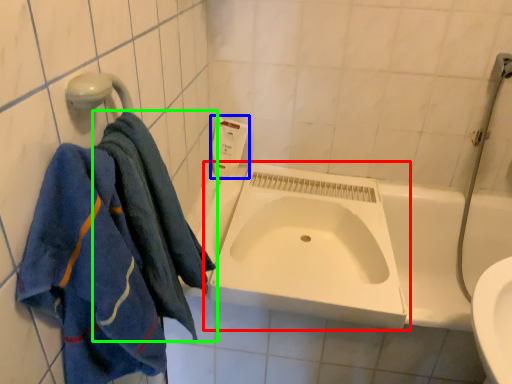
Question: Estimate the real-world distances between objects in this image. Which object is farther from sink (highlighted by a red box), soap dispenser (highlighted by a blue box) or towel (highlighted by a green box)?

Choices:
 (A) soap dispenser
 (B) towel

Answer: (A)